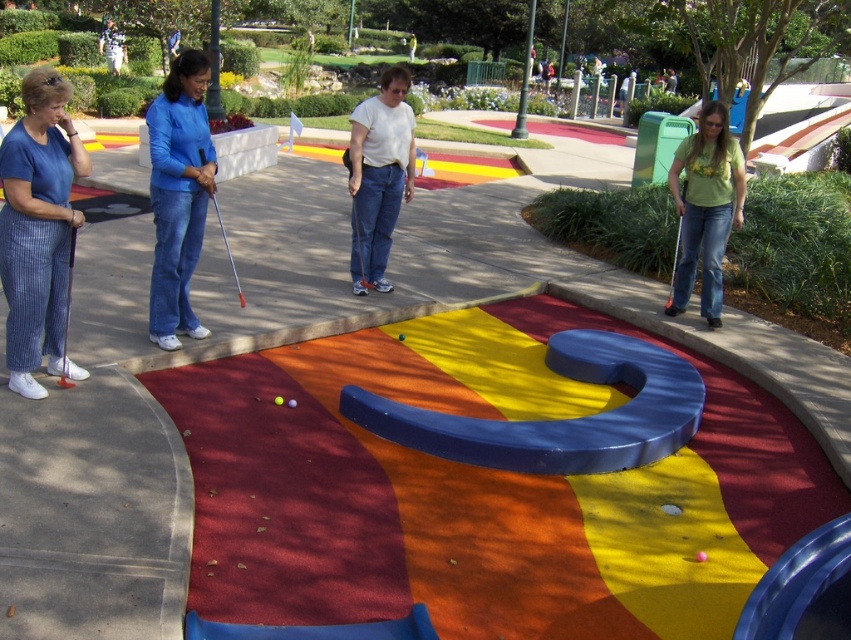
You are playing mini golf and see the green matte golf club at right and the pink matte golf ball at center. Which object is closer to you?

The green matte golf club at right is closer to you because it is further to the viewer than the pink matte golf ball at center.

Based on the photo, you are playing mini golf and want to hit the pink matte golf ball at center into the hole located at point (700, 556). Considering the obstacles on the course, which direction should you aim your shot to reach the hole?

The hole is located at point (700, 556), so you should aim your shot towards that coordinate to reach the hole.

You are playing mini golf and see two golf balls, the pink matte golf ball at center and the yellow matte golf ball at center. Which one is smaller in height?

The pink matte golf ball at center is thinner than the yellow matte golf ball at center, so the pink matte golf ball at center is smaller in height.